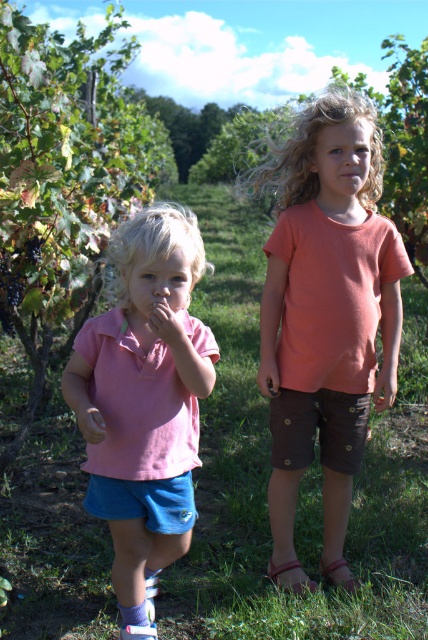
Question: Which point is closer to the camera?

Choices:
 (A) matte coral t-shirt at center
 (B) pink cotton shirt at left

Answer: (B)

Question: In this image, where is matte coral t-shirt at center located relative to pink cotton shirt at left?

Choices:
 (A) above
 (B) below

Answer: (A)

Question: Observing the image, what is the correct spatial positioning of matte coral t-shirt at center in reference to pink cotton shirt at left?

Choices:
 (A) left
 (B) right

Answer: (B)

Question: Which of the following is the closest to the observer?

Choices:
 (A) (282, 529)
 (B) (192, 257)

Answer: (B)

Question: Does matte coral t-shirt at center lie behind pink cotton shirt at left?

Choices:
 (A) no
 (B) yes

Answer: (B)

Question: Among these points, which one is nearest to the camera?

Choices:
 (A) (306, 116)
 (B) (199, 268)

Answer: (B)